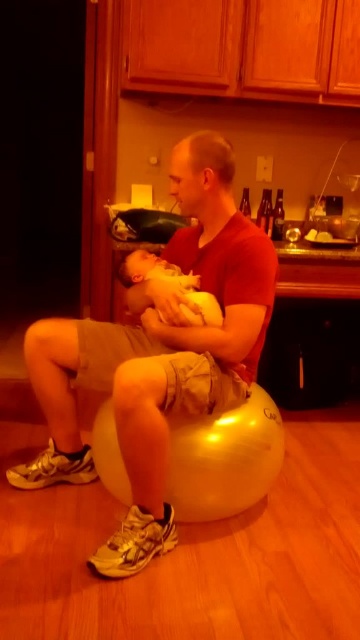
Question: Considering the relative positions of matte red shirt at center and soft yellow fabric baby at center in the image provided, where is matte red shirt at center located with respect to soft yellow fabric baby at center?

Choices:
 (A) below
 (B) above

Answer: (A)

Question: Which of the following is the farthest from the observer?

Choices:
 (A) (123, 540)
 (B) (178, 282)
 (C) (262, 458)

Answer: (B)

Question: Which point is farther to the camera?

Choices:
 (A) (205, 316)
 (B) (209, 502)

Answer: (A)

Question: Is gold fabric bean bag chair at center smaller than soft yellow fabric baby at center?

Choices:
 (A) no
 (B) yes

Answer: (A)

Question: In this image, where is matte red shirt at center located relative to gold fabric bean bag chair at center?

Choices:
 (A) left
 (B) right

Answer: (A)

Question: Which of the following is the closest to the observer?

Choices:
 (A) gold fabric bean bag chair at center
 (B) soft yellow fabric baby at center

Answer: (A)